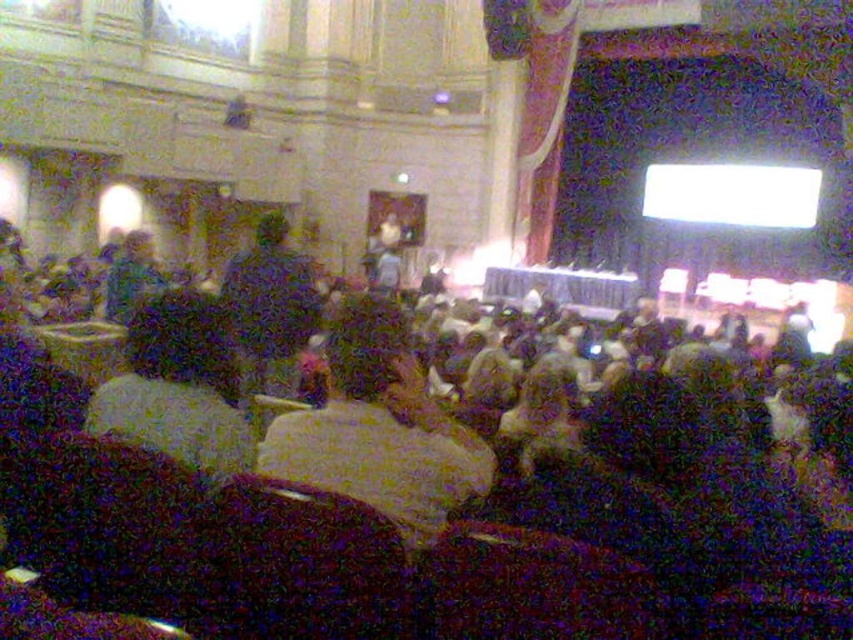
You are organizing a small event in this venue and need to place a 1.2 meter wide decorative table between the light brown fabric chair at center and the dark brown leather jacket at center. Can the table fit between them?

The light brown fabric chair at center is narrower than the dark brown leather jacket at center. However, the combined width of both objects is not provided. Without knowing their total width, it is impossible to determine if the 1.2 meter table will fit between them.

You are sitting in the auditorium and want to determine which of the two points, point (299, 376) or point (160, 284), is nearer to you. Based on the scene description, which point is closer?

Point (299, 376) is closer to the viewer than point (160, 284).